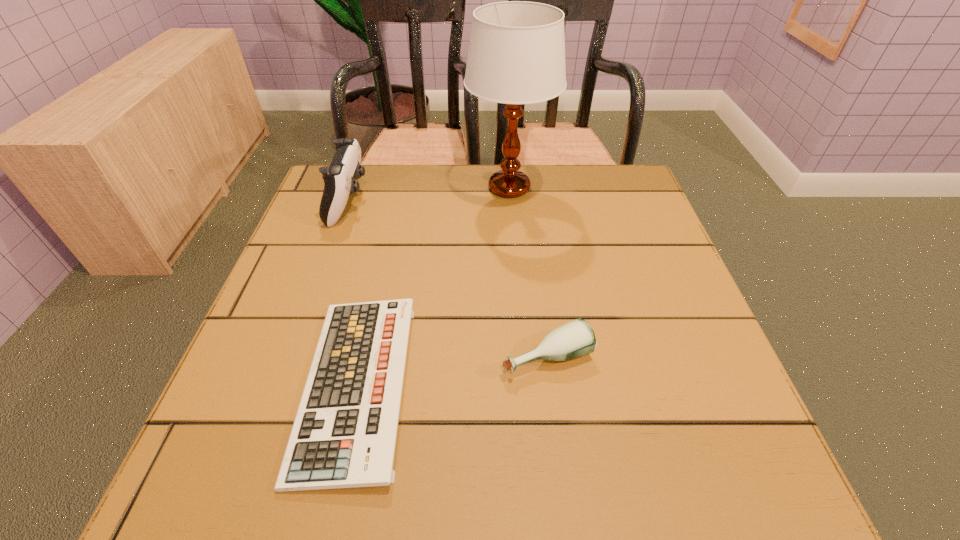
You are a GUI agent. You are given a task and a screenshot of the screen. Output one action in this format:
    pyautogui.click(x=<x>, y=<y>)
    Task: Click on the table lamp
    
    Given the screenshot: What is the action you would take?
    pyautogui.click(x=516, y=55)

This screenshot has width=960, height=540. Find the location of `the third shortest object`. the third shortest object is located at coordinates (339, 178).

This screenshot has height=540, width=960. In order to click on bottle in this screenshot , I will do `click(574, 339)`.

Image resolution: width=960 pixels, height=540 pixels. I want to click on computer keyboard, so click(x=344, y=435).

Locate an element on the screen. The height and width of the screenshot is (540, 960). vacant space located 0.210m on the left of the table lamp is located at coordinates (384, 188).

Where is `vacant space located on the front-facing side of the second tallest object`? vacant space located on the front-facing side of the second tallest object is located at coordinates (492, 202).

Locate an element on the screen. The height and width of the screenshot is (540, 960). free space located 0.170m on the front of the bottle is located at coordinates (564, 488).

Locate an element on the screen. Image resolution: width=960 pixels, height=540 pixels. vacant space located on the right of the shortest object is located at coordinates (462, 386).

Locate an element on the screen. This screenshot has width=960, height=540. table lamp situated at the far edge is located at coordinates (516, 55).

Find the location of a particular element. Image resolution: width=960 pixels, height=540 pixels. control at the far edge is located at coordinates (339, 178).